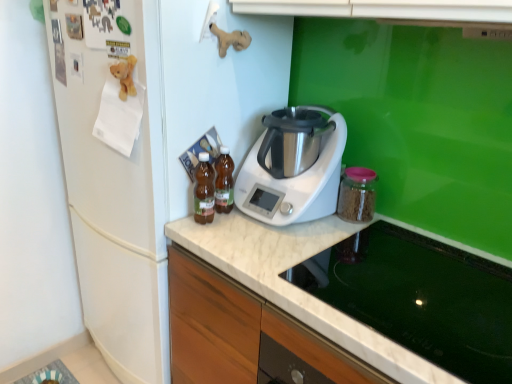
The width and height of the screenshot is (512, 384). Find the location of `vacant region in front of brown glass bottles at center, which is the 1th kitchen appliance in left-to-right order`. vacant region in front of brown glass bottles at center, which is the 1th kitchen appliance in left-to-right order is located at coordinates (213, 241).